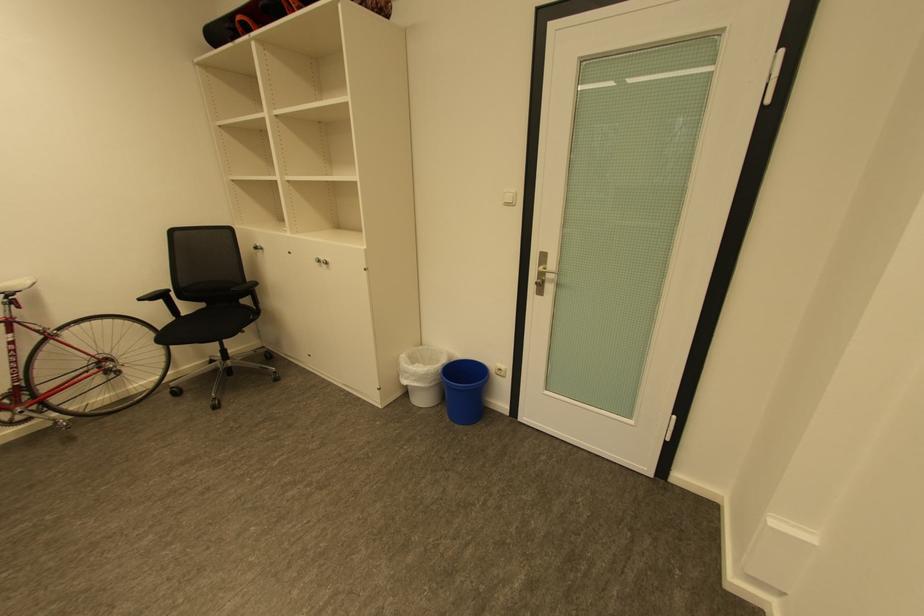
Image resolution: width=924 pixels, height=616 pixels. Find the location of `chair sitting surface`. chair sitting surface is located at coordinates (202, 326).